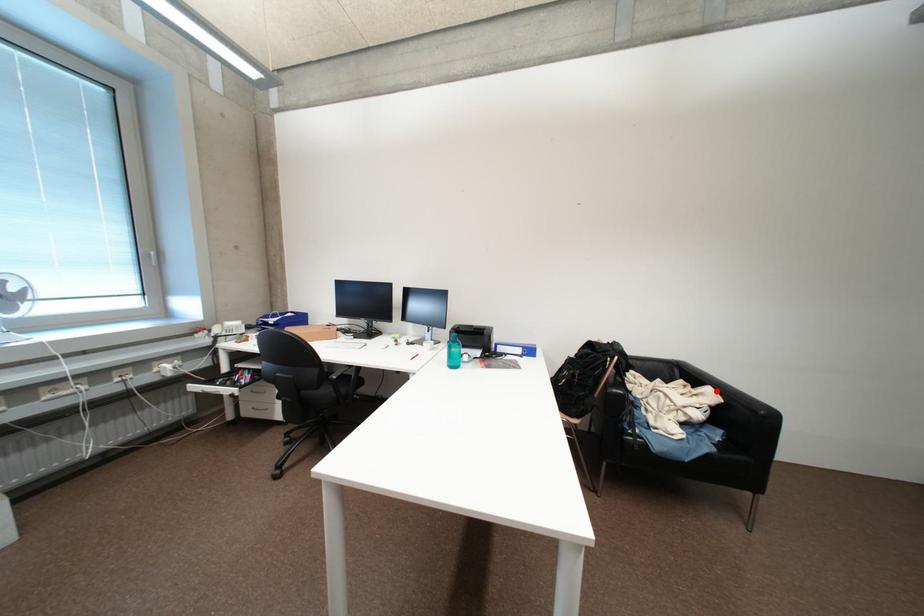
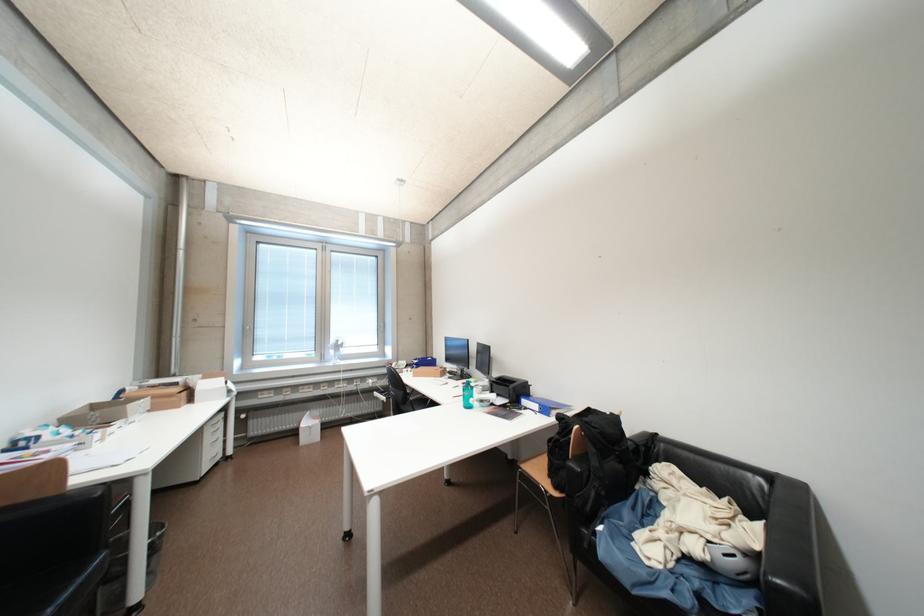
Question: I am providing you with two images of the same scene from different viewpoints. A red point is marked on the first image. Can you still see the location of the red point in image 2?

Choices:
 (A) Yes
 (B) No

Answer: (A)